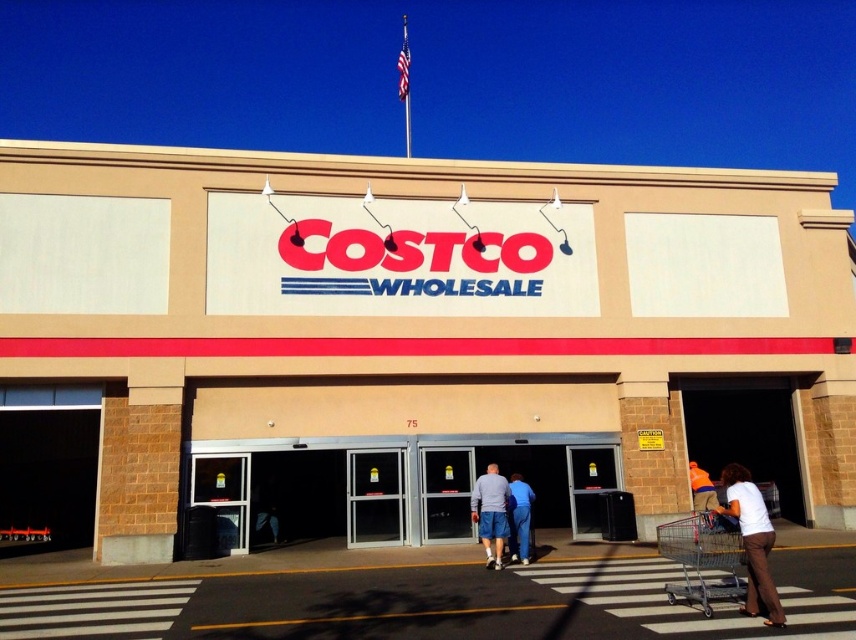
Does beige/brick wall at center have a lesser width compared to orange fabric shirt at lower right?

No, beige/brick wall at center is not thinner than orange fabric shirt at lower right.

Does point (120, 468) come behind point (693, 476)?

That is False.

Locate an element on the screen. Image resolution: width=856 pixels, height=640 pixels. beige/brick wall at center is located at coordinates (412, 317).

Is point (401, 472) less distant than point (527, 524)?

No, it is behind (527, 524).

Which is above, matte glass doors at center or blue cotton pants at center?

Positioned higher is blue cotton pants at center.

Which is in front, point (420, 472) or point (519, 541)?

Positioned in front is point (519, 541).

This screenshot has width=856, height=640. Identify the location of matte glass doors at center. (382, 486).

Is beige/brick wall at center to the right of white cotton shirt at lower right from the viewer's perspective?

No, beige/brick wall at center is not to the right of white cotton shirt at lower right.

Is beige/brick wall at center bigger than white cotton shirt at lower right?

Yes, beige/brick wall at center is bigger than white cotton shirt at lower right.

Is point (321, 189) positioned after point (753, 541)?

Yes.

The image size is (856, 640). What are the coordinates of `beige/brick wall at center` in the screenshot? It's located at (412, 317).